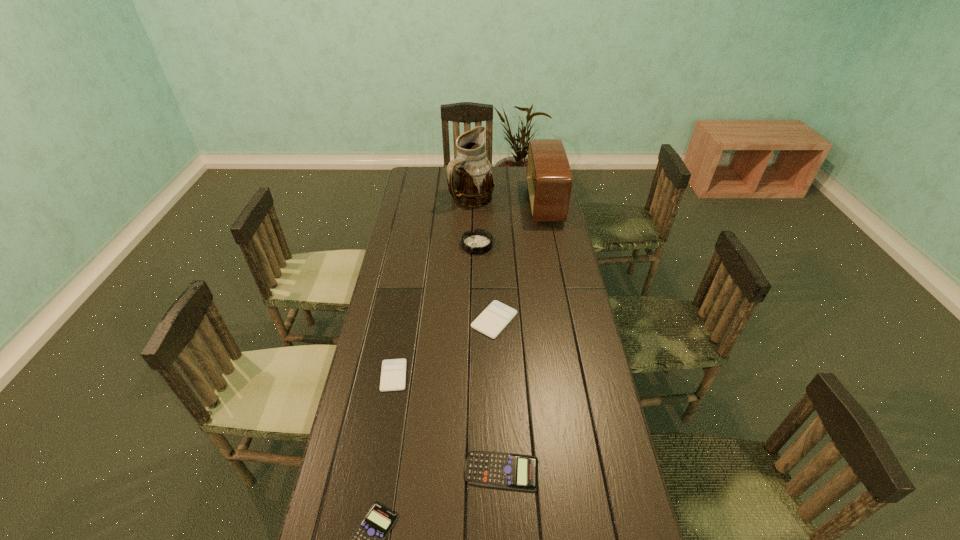
Identify the location of vacant region between the brown pitcher and the dark ashtray. This screenshot has width=960, height=540. (474, 222).

At what (x,y) coordinates should I click in order to perform the action: click on the closest object relative to the bigger blue calculator. Please return your answer as a coordinate pair (x, y). This screenshot has height=540, width=960. Looking at the image, I should click on (368, 539).

Select which object is the fourth closest to the second nearest object. Please provide its 2D coordinates. Your answer should be formatted as a tuple, i.e. [(x, y)], where the tuple contains the x and y coordinates of a point satisfying the conditions above.

[(479, 241)]

In order to click on the third closest calculator to the farther blue calculator in this screenshot , I will do `click(491, 322)`.

Locate which calculator ranks fourth in proximity to the radio receiver. Please provide its 2D coordinates. Your answer should be formatted as a tuple, i.e. [(x, y)], where the tuple contains the x and y coordinates of a point satisfying the conditions above.

[(368, 539)]

Identify which blue calculator is located as the second nearest to the radio receiver. Please provide its 2D coordinates. Your answer should be formatted as a tuple, i.e. [(x, y)], where the tuple contains the x and y coordinates of a point satisfying the conditions above.

[(368, 539)]

Identify which blue calculator is located as the second nearest to the fifth shortest object. Please provide its 2D coordinates. Your answer should be formatted as a tuple, i.e. [(x, y)], where the tuple contains the x and y coordinates of a point satisfying the conditions above.

[(368, 539)]